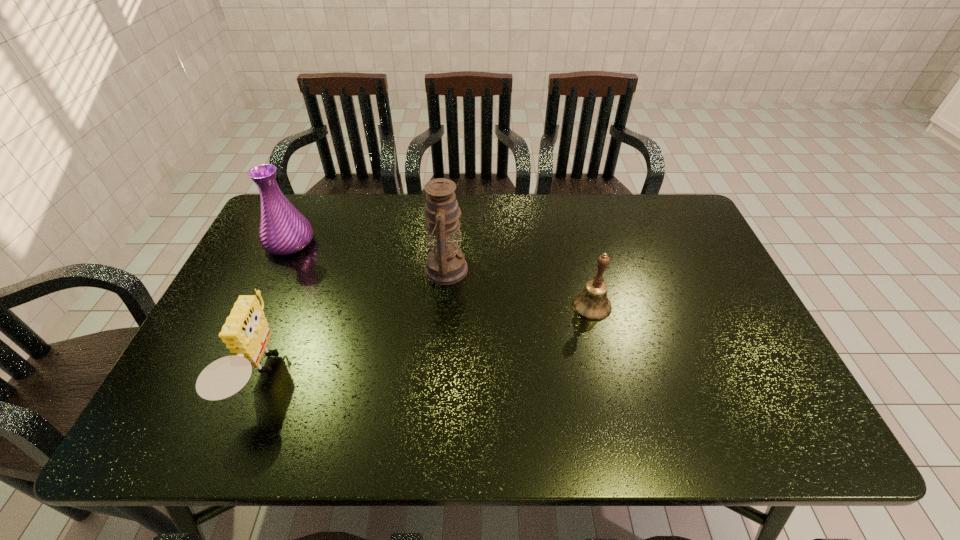
At what (x,y) coordinates should I click in order to perform the action: click on the third object from left to right. Please return your answer as a coordinate pair (x, y). The height and width of the screenshot is (540, 960). Looking at the image, I should click on (445, 264).

Find the location of a particular element. This screenshot has width=960, height=540. vase is located at coordinates (283, 230).

Where is `the rightmost object`? the rightmost object is located at coordinates (592, 303).

The width and height of the screenshot is (960, 540). In order to click on sponge in this screenshot , I will do 245,333.

Where is `free space located 0.050m on the back of the third object from left to right`? The height and width of the screenshot is (540, 960). free space located 0.050m on the back of the third object from left to right is located at coordinates (446, 237).

At what (x,y) coordinates should I click in order to perform the action: click on free space located on the front of the second tallest object. Please return your answer as a coordinate pair (x, y). This screenshot has width=960, height=540. Looking at the image, I should click on (255, 316).

Find the location of `free space located on the back of the bell`. free space located on the back of the bell is located at coordinates (568, 209).

You are a GUI agent. You are given a task and a screenshot of the screen. Output one action in this format:
    pyautogui.click(x=<x>, y=<y>)
    Task: Click on the vacant space located 0.070m on the front-facing side of the nearest object
    
    Given the screenshot: What is the action you would take?
    pyautogui.click(x=311, y=375)

The width and height of the screenshot is (960, 540). In order to click on object located in the far edge section of the desktop in this screenshot , I will do `click(283, 230)`.

You are a GUI agent. You are given a task and a screenshot of the screen. Output one action in this format:
    pyautogui.click(x=<x>, y=<y>)
    Task: Click on the object located in the near edge section of the desktop
    The width and height of the screenshot is (960, 540).
    Given the screenshot: What is the action you would take?
    pyautogui.click(x=245, y=333)